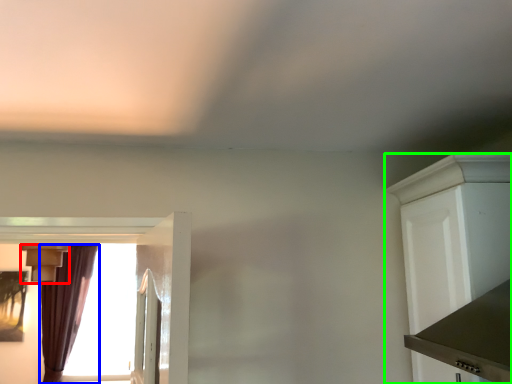
Question: Estimate the real-world distances between objects in this image. Which object is farther from light fixture (highlighted by a red box), curtain (highlighted by a blue box) or cabinetry (highlighted by a green box)?

Choices:
 (A) curtain
 (B) cabinetry

Answer: (B)